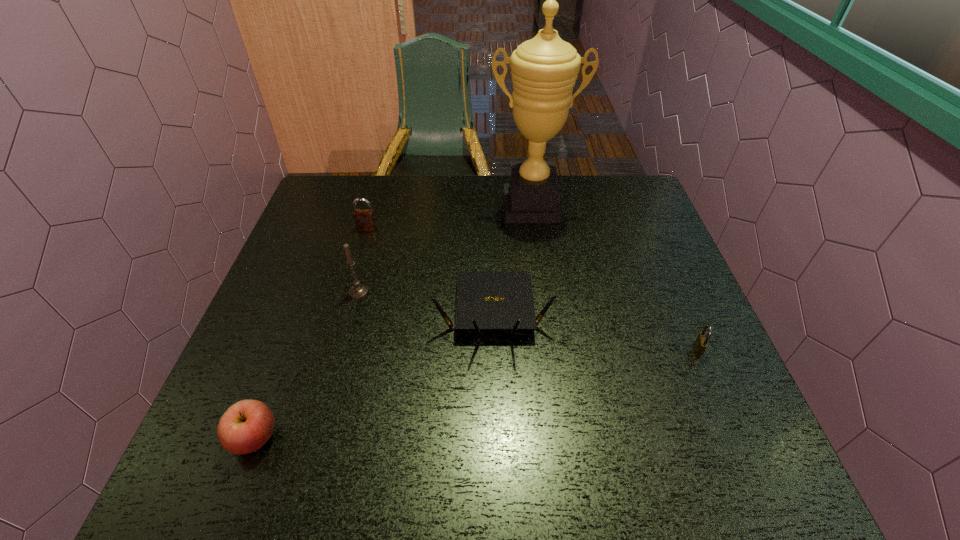
This screenshot has height=540, width=960. Identify the location of vacant space situated at the front of the tallest object with handles. (540, 265).

Image resolution: width=960 pixels, height=540 pixels. Find the location of `free region located 0.200m on the right of the candle`. free region located 0.200m on the right of the candle is located at coordinates (449, 292).

Locate an element on the screen. The image size is (960, 540). vacant region located on the back of the router is located at coordinates (490, 199).

The image size is (960, 540). What are the coordinates of `free region located 0.060m on the front-facing side of the second farthest object` in the screenshot? It's located at (362, 245).

Locate an element on the screen. The height and width of the screenshot is (540, 960). free space located on the right of the nearest object is located at coordinates (467, 437).

Locate an element on the screen. This screenshot has width=960, height=540. free location located on the back of the rightmost object is located at coordinates (659, 258).

Find the location of a particular element. object present at the far edge is located at coordinates (544, 69).

The image size is (960, 540). Identify the location of object situated at the near edge. (247, 425).

The height and width of the screenshot is (540, 960). I want to click on object at the left edge, so 247,425.

The height and width of the screenshot is (540, 960). Identify the location of object that is positioned at the right edge. (700, 344).